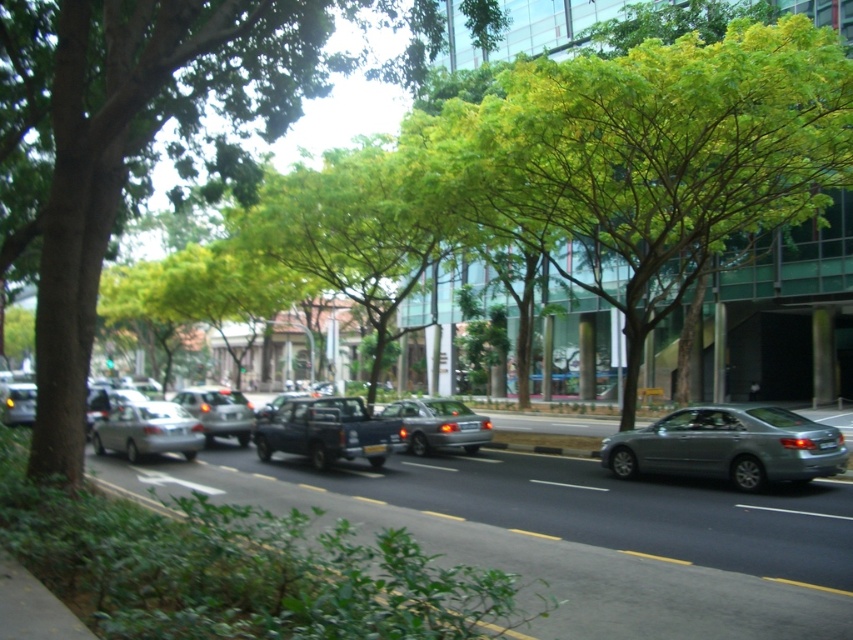
Can you confirm if green leafy tree at center is positioned above matte black pickup truck at center?

Yes, green leafy tree at center is above matte black pickup truck at center.

Looking at this image, can you confirm if green leafy tree at center is wider than matte black pickup truck at center?

Correct, the width of green leafy tree at center exceeds that of matte black pickup truck at center.

This screenshot has width=853, height=640. In order to click on green leafy tree at center in this screenshot , I will do `click(138, 136)`.

Does green leafy tree at center appear on the right side of satin silver sedan at center?

Yes, green leafy tree at center is to the right of satin silver sedan at center.

Is green leafy tree at center taller than satin silver sedan at center?

Yes, green leafy tree at center is taller than satin silver sedan at center.

Identify the location of green leafy tree at center. (138, 136).

In the scene shown: Can you confirm if matte black pickup truck at center is thinner than matte silver sedan at center?

No.

Between matte black pickup truck at center and matte silver sedan at center, which one has more height?

matte black pickup truck at center

Is point (277, 410) in front of point (442, 404)?

Yes, point (277, 410) is in front of point (442, 404).

The image size is (853, 640). What are the coordinates of `matte black pickup truck at center` in the screenshot? It's located at (326, 432).